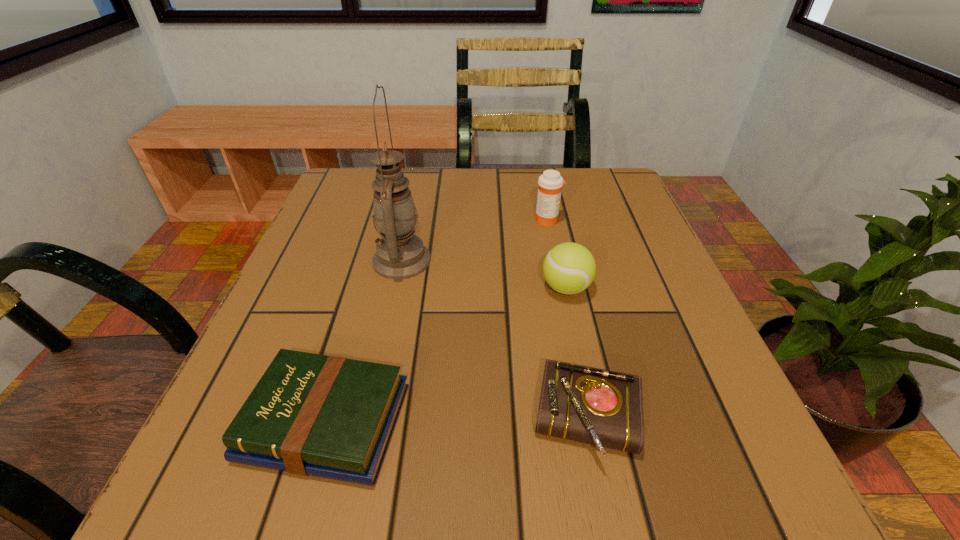
In order to click on vacant region at the far edge of the desktop in this screenshot , I will do `click(510, 170)`.

This screenshot has height=540, width=960. In order to click on free region at the near edge in this screenshot , I will do `click(517, 469)`.

The height and width of the screenshot is (540, 960). In the image, there is a desktop. What are the coordinates of `vacant space at the left edge` in the screenshot? It's located at (346, 269).

In the image, there is a desktop. In order to click on free space at the right edge in this screenshot , I will do `click(685, 315)`.

Where is `free region at the far left corner of the desktop`? This screenshot has height=540, width=960. free region at the far left corner of the desktop is located at coordinates point(369,167).

Locate an element on the screen. The height and width of the screenshot is (540, 960). vacant region between the diary and the book is located at coordinates (457, 422).

In order to click on free space between the diary and the book in this screenshot , I will do `click(457, 422)`.

Identify the location of free space between the book and the oil lamp. (364, 341).

At what (x,y) coordinates should I click in order to perform the action: click on free space between the diary and the tennis ball. Please return your answer as a coordinate pair (x, y). Looking at the image, I should click on (577, 355).

Identify the location of vacant point located between the fourth shortest object and the book. (437, 321).